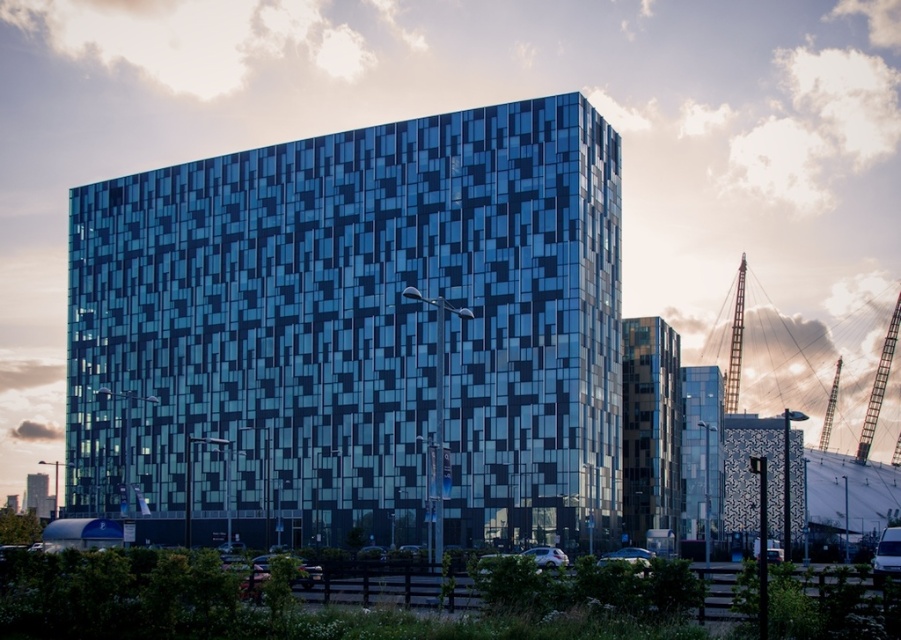
Who is higher up, metallic silver crane at right or shiny silver car at lower center?

metallic silver crane at right is higher up.

Does metallic silver crane at right have a greater width compared to shiny silver car at lower center?

Indeed, metallic silver crane at right has a greater width compared to shiny silver car at lower center.

Is point (861, 429) more distant than point (633, 548)?

That is True.

Find the location of a particular element. The image size is (901, 640). metallic silver crane at right is located at coordinates (878, 387).

Who is shorter, metallic silver crane at upper right or metallic silver car at lower center?

Standing shorter between the two is metallic silver car at lower center.

Is point (717, 323) closer to camera compared to point (545, 554)?

That is False.

Does point (874, 368) come closer to viewer compared to point (533, 554)?

No.

Locate an element on the screen. The image size is (901, 640). metallic silver crane at upper right is located at coordinates click(799, 356).

Can you confirm if metallic silver crane at right is smaller than metallic silver car at lower center?

No.

Which is above, metallic silver crane at right or metallic silver car at lower center?

metallic silver car at lower center is above.

At what (x,y) coordinates should I click in order to perform the action: click on metallic silver crane at right. Please return your answer as a coordinate pair (x, y). This screenshot has height=640, width=901. Looking at the image, I should click on (878, 387).

Image resolution: width=901 pixels, height=640 pixels. I want to click on metallic silver crane at right, so click(878, 387).